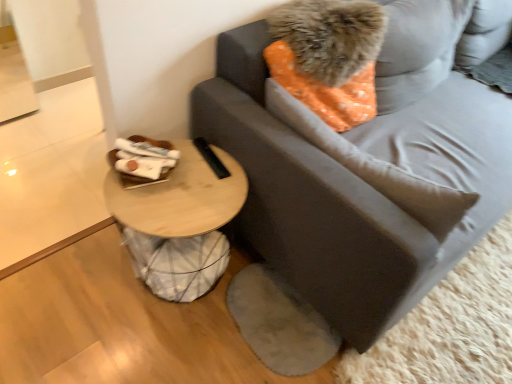
Where is `free space in front of woodenmaterial/texturetable at lower left`? The image size is (512, 384). free space in front of woodenmaterial/texturetable at lower left is located at coordinates (151, 347).